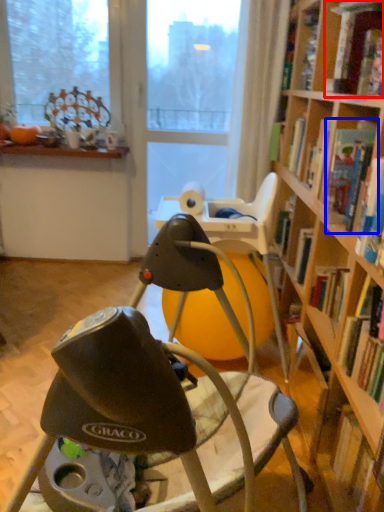
Question: Which object is further to the camera taking this photo, book (highlighted by a red box) or book (highlighted by a blue box)?

Choices:
 (A) book
 (B) book

Answer: (B)